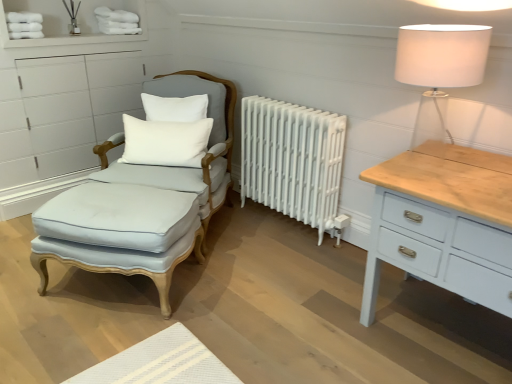
Question: Is point (199, 120) positioned closer to the camera than point (165, 312)?

Choices:
 (A) farther
 (B) closer

Answer: (A)

Question: In terms of width, does white cotton pillow at center, placed as the 2th pillow when sorted from top to bottom, look wider or thinner when compared to light blue fabric footrest at left?

Choices:
 (A) thin
 (B) wide

Answer: (A)

Question: Which object is positioned closest to the light blue fabric footrest at left?

Choices:
 (A) white cotton pillow at center, the first pillow in the bottom-to-top sequence
 (B) white cotton pillow at upper center, which ranks as the first pillow in top-to-bottom order
 (C) light blue fabric swivel chair at left
 (D) white painted metal radiator at center
 (E) white fabric lampshade at upper right

Answer: (C)

Question: Estimate the real-world distances between objects in this image. Which object is farther from the light blue fabric swivel chair at left?

Choices:
 (A) light blue fabric footrest at left
 (B) white painted metal radiator at center
 (C) white cotton pillow at upper center, the second pillow ordered from the bottom
 (D) white cotton pillow at center, placed as the 2th pillow when sorted from top to bottom
 (E) white fabric lampshade at upper right

Answer: (E)